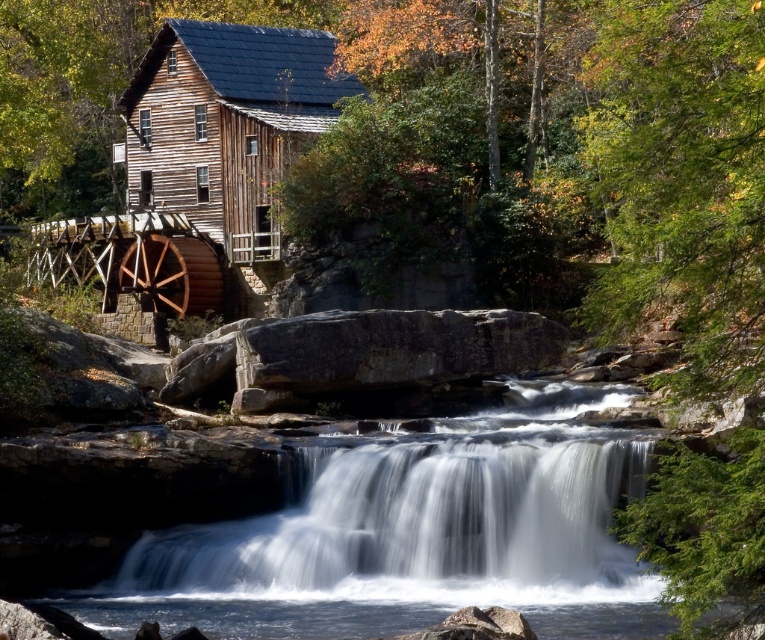
Question: Which point appears closest to the camera in this image?

Choices:
 (A) (252, 563)
 (B) (324, 545)

Answer: (A)

Question: Which of the following is the closest to the observer?

Choices:
 (A) white smooth waterfall at center
 (B) white smooth water at center

Answer: (B)

Question: Observing the image, what is the correct spatial positioning of white smooth water at center in reference to white smooth waterfall at center?

Choices:
 (A) below
 (B) above

Answer: (B)

Question: Is white smooth water at center to the left of white smooth waterfall at center from the viewer's perspective?

Choices:
 (A) yes
 (B) no

Answer: (B)

Question: In this image, where is white smooth waterfall at center located relative to wooden cabin at center?

Choices:
 (A) right
 (B) left

Answer: (A)

Question: Among these objects, which one is farthest from the camera?

Choices:
 (A) wooden cabin at center
 (B) white smooth water at center

Answer: (A)